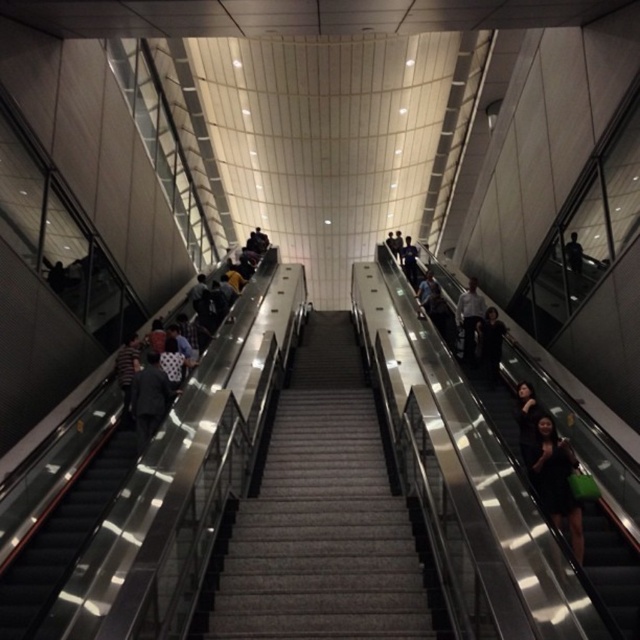
Question: Among these objects, which one is farthest from the camera?

Choices:
 (A) metallic gray stairs at left
 (B) dark gray carpeted stairs at center
 (C) metallic silver escalator at right

Answer: (A)

Question: Is metallic silver escalator at right bigger than dark gray fabric jacket at upper right?

Choices:
 (A) no
 (B) yes

Answer: (B)

Question: Which of these objects is positioned farthest from the white shirt at center?

Choices:
 (A) striped shirt at left
 (B) black matte dress at right

Answer: (A)

Question: Is metallic gray stairs at left smaller than dark gray fabric jacket at upper right?

Choices:
 (A) yes
 (B) no

Answer: (B)

Question: Does black matte dress at right come in front of white shirt at center?

Choices:
 (A) no
 (B) yes

Answer: (B)

Question: Estimate the real-world distances between objects in this image. Which object is farther from the dark gray fabric jacket at left?

Choices:
 (A) metallic silver escalator at right
 (B) striped shirt at left
 (C) black matte dress at right
 (D) dark gray fabric jacket at upper right

Answer: (D)